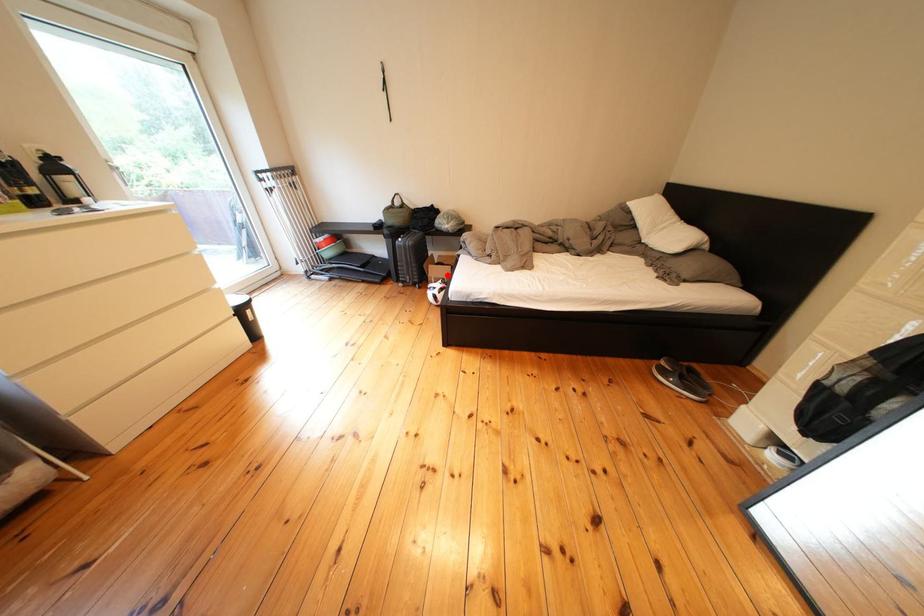
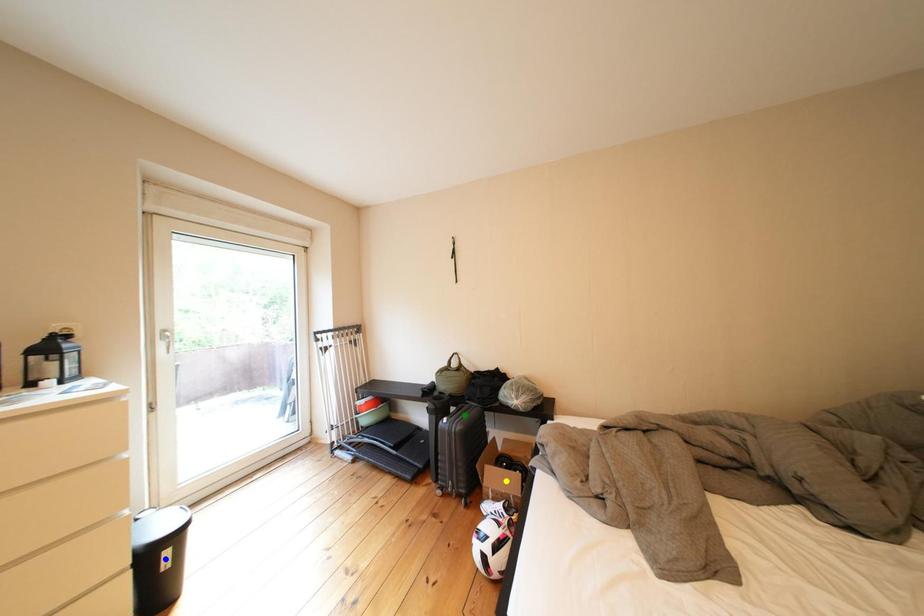
Question: I am providing you with two images of the same scene from different viewpoints. A red point is marked on the first image. You are given multiple points on the second image. Which point in image 2 is actually the same real-world point as the red point in image 1?

Choices:
 (A) green point
 (B) blue point
 (C) yellow point

Answer: (C)